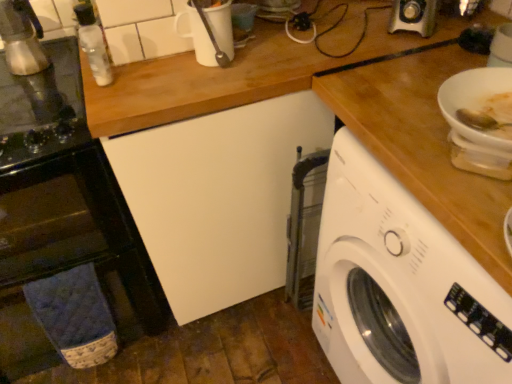
Question: Relative to metallic silver coffee maker at left, placed as the second appliance when sorted from top to bottom, is metallic silver espresso maker at left, the first appliance in the top-to-bottom sequence, in front or behind?

Choices:
 (A) front
 (B) behind

Answer: (B)

Question: From a real-world perspective, is metallic silver espresso maker at left, the first appliance in the top-to-bottom sequence, positioned above or below metallic silver coffee maker at left, placed as the second appliance when sorted from top to bottom?

Choices:
 (A) above
 (B) below

Answer: (A)

Question: Which is farther from the white matte bowl at upper right?

Choices:
 (A) blue fabric oven towel at lower left
 (B) white plastic washing machine at right
 (C) metallic silver coffee maker at left, placed as the second appliance when sorted from top to bottom
 (D) clear glass bottle at upper left
 (E) metallic silver espresso maker at left, the first appliance in the top-to-bottom sequence

Answer: (E)

Question: Which of these objects is positioned farthest from the metallic silver espresso maker at left, the first appliance in the top-to-bottom sequence?

Choices:
 (A) white plastic washing machine at right
 (B) metallic silver coffee maker at left, placed as the second appliance when sorted from top to bottom
 (C) clear glass bottle at upper left
 (D) white matte bowl at upper right
 (E) blue fabric oven towel at lower left

Answer: (D)